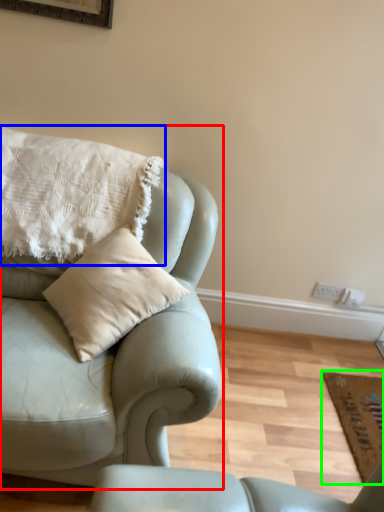
Question: Considering the real-world distances, which object is closest to studio couch (highlighted by a red box)? pillow (highlighted by a blue box) or mat (highlighted by a green box).

Choices:
 (A) pillow
 (B) mat

Answer: (A)